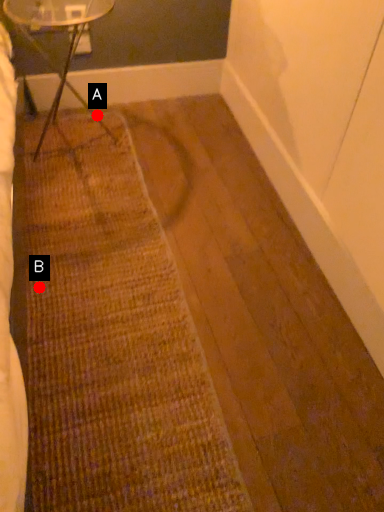
Question: Two points are circled on the image, labeled by A and B beside each circle. Which of the following is the farthest from the observer?

Choices:
 (A) A is further
 (B) B is further

Answer: (A)